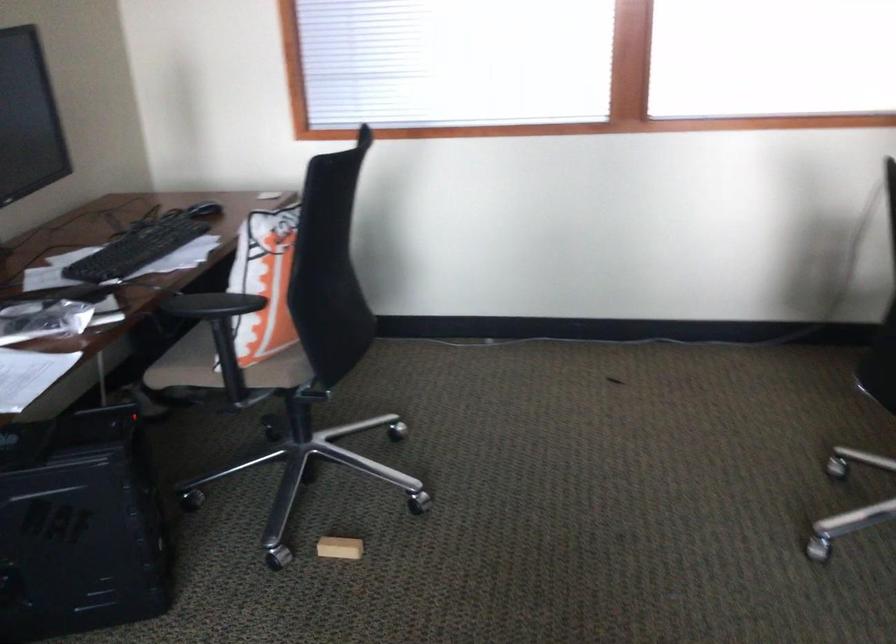
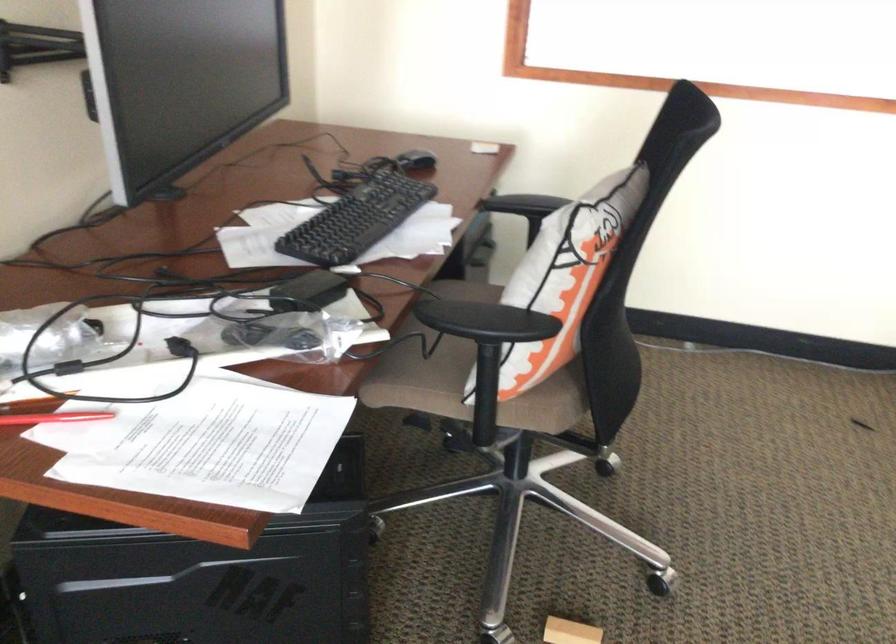
Find the pixel in the second image that matches pixel 134 249 in the first image.

(356, 220)